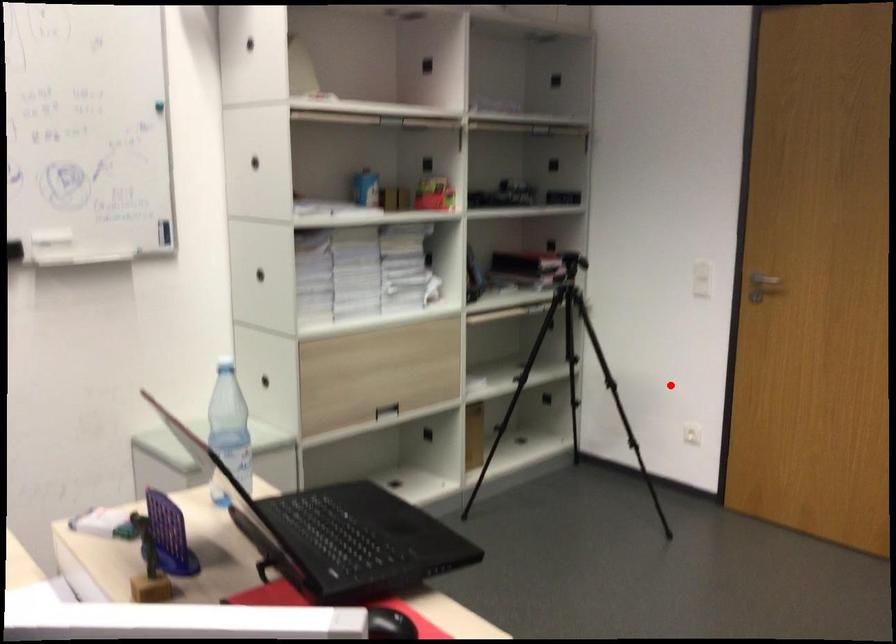
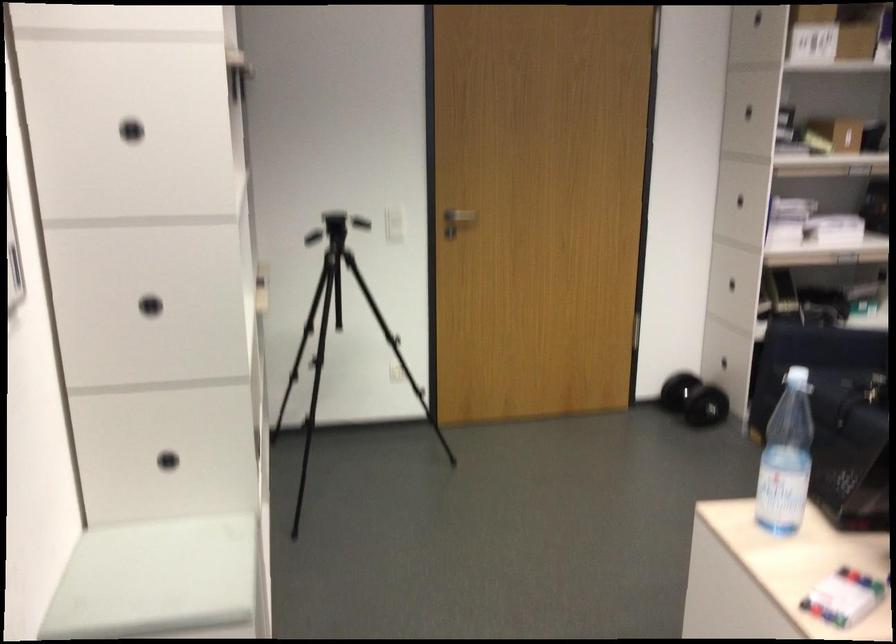
The point at the highlighted location is marked in the first image. Where is the corresponding point in the second image?

(339, 334)